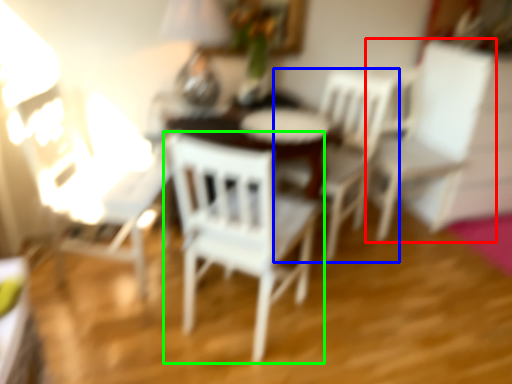
Question: Considering the real-world distances, which object is closest to chair (highlighted by a red box)? chair (highlighted by a blue box) or chair (highlighted by a green box).

Choices:
 (A) chair
 (B) chair

Answer: (A)